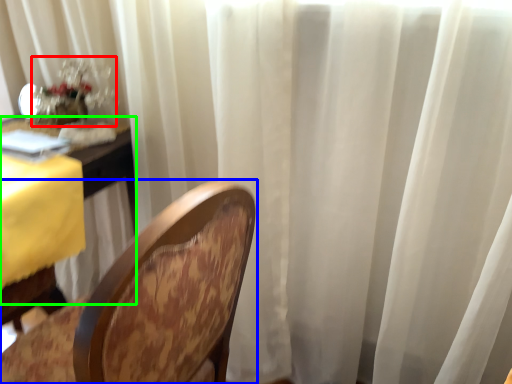
Question: Based on their relative distances, which object is nearer to floral arrangement (highlighted by a red box)? Choose from chair (highlighted by a blue box) and table (highlighted by a green box).

Choices:
 (A) chair
 (B) table

Answer: (B)